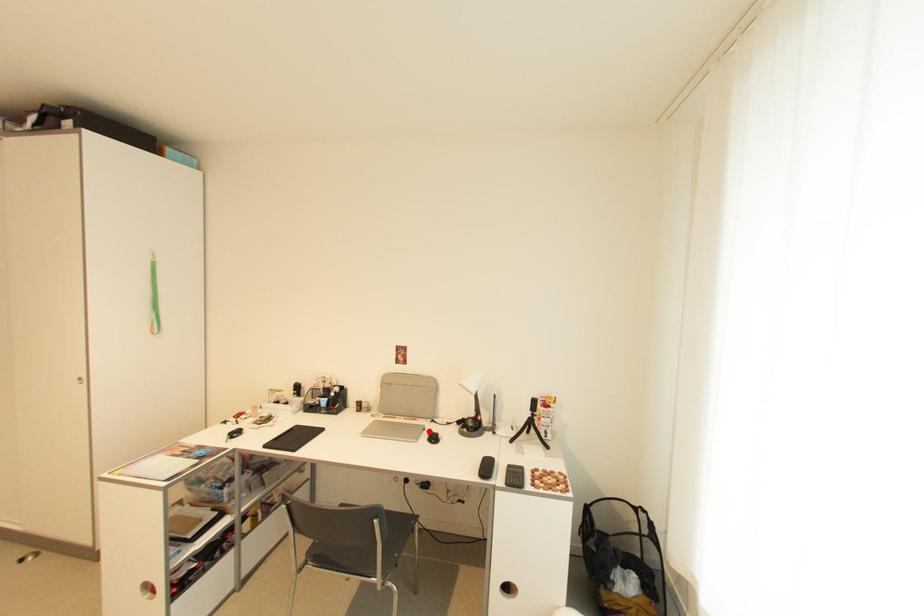
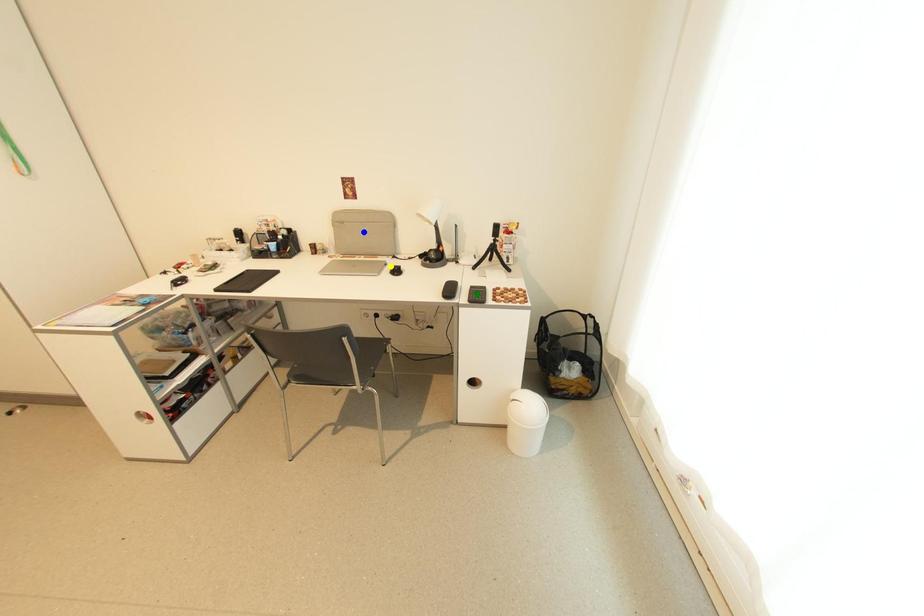
Question: I am providing you with two images of the same scene from different viewpoints. A red point is marked on the first image. You are given multiple points on the second image. In image 2, which mark is for the same physical point as the one in image 1?

Choices:
 (A) green point
 (B) blue point
 (C) yellow point

Answer: (C)